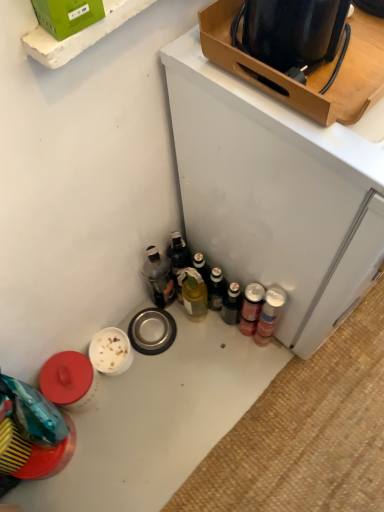
At what (x,y) coordinates should I click in order to perform the action: click on free spot in front of metallic silver canisters at lower right. Please return your answer as a coordinate pair (x, y). This screenshot has width=384, height=512. Looking at the image, I should click on (289, 402).